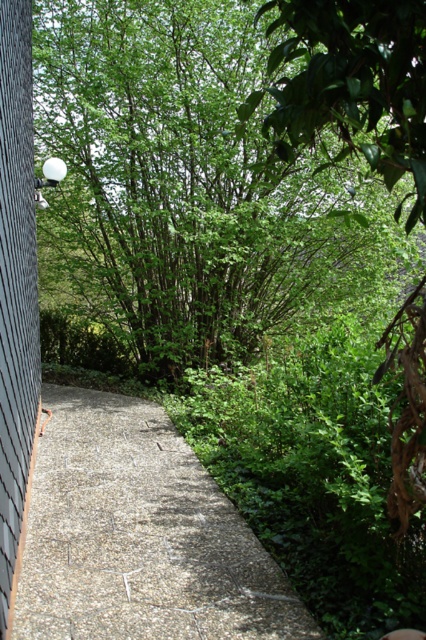
You are a gardener planning to walk along the gravelly stone path at center and the gray textured siding at left. Which path is wider?

The gravelly stone path at center is wider than the gray textured siding at left.

You are standing at the starting point of the pathway in the image and want to reach the point marked at the coordinates point (224, 198) and point (29, 456). Which of these points is closer to you?

Point (29, 456) is closer to you because it is less further to the camera than point (224, 198).